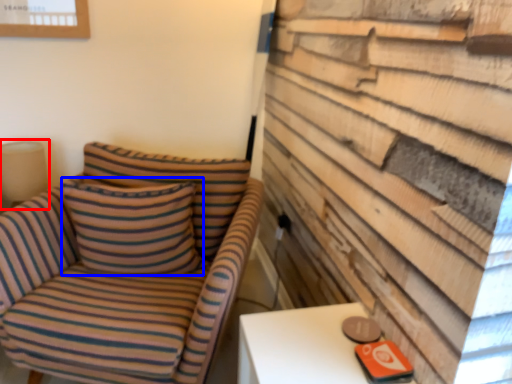
Question: Which of the following is the closest to the observer, table lamp (highlighted by a red box) or pillow (highlighted by a blue box)?

Choices:
 (A) table lamp
 (B) pillow

Answer: (B)